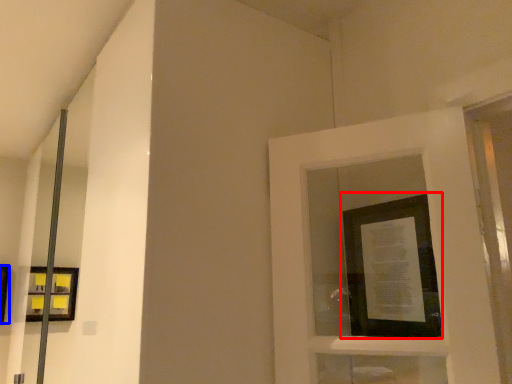
Question: Which of the following is the closest to the observer, picture frame (highlighted by a red box) or picture frame (highlighted by a blue box)?

Choices:
 (A) picture frame
 (B) picture frame

Answer: (A)